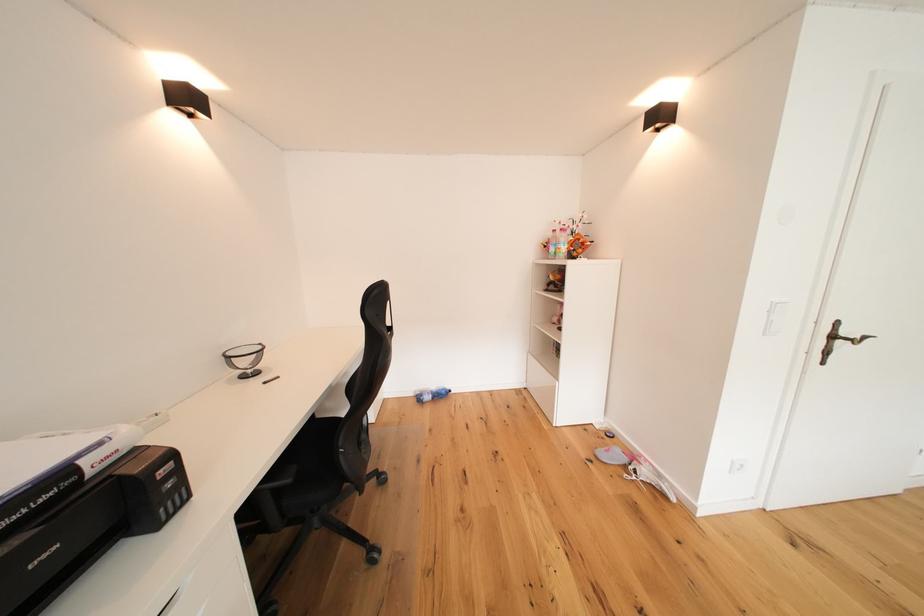
Find where to lift the printer top cover. Please return your answer as a coordinate pair (x, y).

(51, 455)